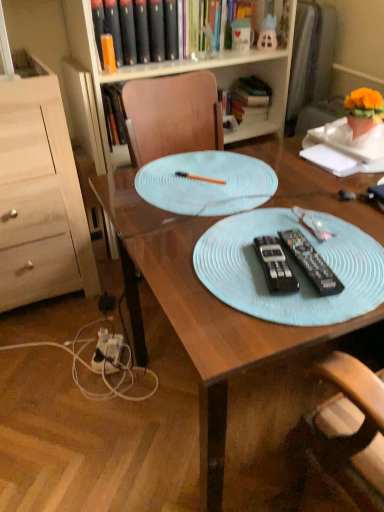
Question: Is white plastic power outlet at lower left facing away from black plastic remote control at center, which appears as the 1th remote control when viewed from the left?

Choices:
 (A) no
 (B) yes

Answer: (A)

Question: Can black plastic remote control at center, which appears as the 1th remote control when viewed from the left, be found inside white plastic power outlet at lower left?

Choices:
 (A) yes
 (B) no

Answer: (B)

Question: Does white plastic power outlet at lower left turn towards black plastic remote control at center, marked as the second remote control in a right-to-left arrangement?

Choices:
 (A) yes
 (B) no

Answer: (B)

Question: Does white plastic power outlet at lower left have a larger size compared to black plastic remote control at center, which appears as the 1th remote control when viewed from the left?

Choices:
 (A) yes
 (B) no

Answer: (A)

Question: From a real-world perspective, is white plastic power outlet at lower left beneath black plastic remote control at center, marked as the second remote control in a right-to-left arrangement?

Choices:
 (A) yes
 (B) no

Answer: (A)

Question: From their relative heights in the image, would you say light wood dresser at left is taller or shorter than hardcover book at upper center, the second book positioned from the left?

Choices:
 (A) tall
 (B) short

Answer: (A)

Question: Considering the positions of light wood dresser at left and hardcover book at upper center, marked as the 2th book in a front-to-back arrangement, in the image, is light wood dresser at left wider or thinner than hardcover book at upper center, marked as the 2th book in a front-to-back arrangement,?

Choices:
 (A) thin
 (B) wide

Answer: (B)

Question: Looking at the image, does light wood dresser at left seem bigger or smaller compared to hardcover book at upper center, marked as the 2th book in a front-to-back arrangement?

Choices:
 (A) big
 (B) small

Answer: (A)

Question: Does point (67, 175) appear closer or farther from the camera than point (253, 92)?

Choices:
 (A) farther
 (B) closer

Answer: (B)

Question: From a real-world perspective, is wooden bookcase at upper center above or below light blue fabric placemat at center?

Choices:
 (A) below
 (B) above

Answer: (A)

Question: From the image's perspective, is wooden bookcase at upper center positioned above or below light blue fabric placemat at center?

Choices:
 (A) above
 (B) below

Answer: (A)

Question: Is wooden bookcase at upper center in front of or behind light blue fabric placemat at center in the image?

Choices:
 (A) behind
 (B) front

Answer: (A)

Question: In terms of size, does wooden bookcase at upper center appear bigger or smaller than light blue fabric placemat at center?

Choices:
 (A) big
 (B) small

Answer: (A)

Question: From the image's perspective, relative to black plastic remote control at center, the 2th remote control positioned from the left, is black plastic remote control at center, which appears as the 1th remote control when viewed from the left, above or below?

Choices:
 (A) above
 (B) below

Answer: (B)

Question: Is black plastic remote control at center, marked as the second remote control in a right-to-left arrangement, bigger or smaller than black plastic remote control at center, the 1th remote control when ordered from right to left?

Choices:
 (A) big
 (B) small

Answer: (B)